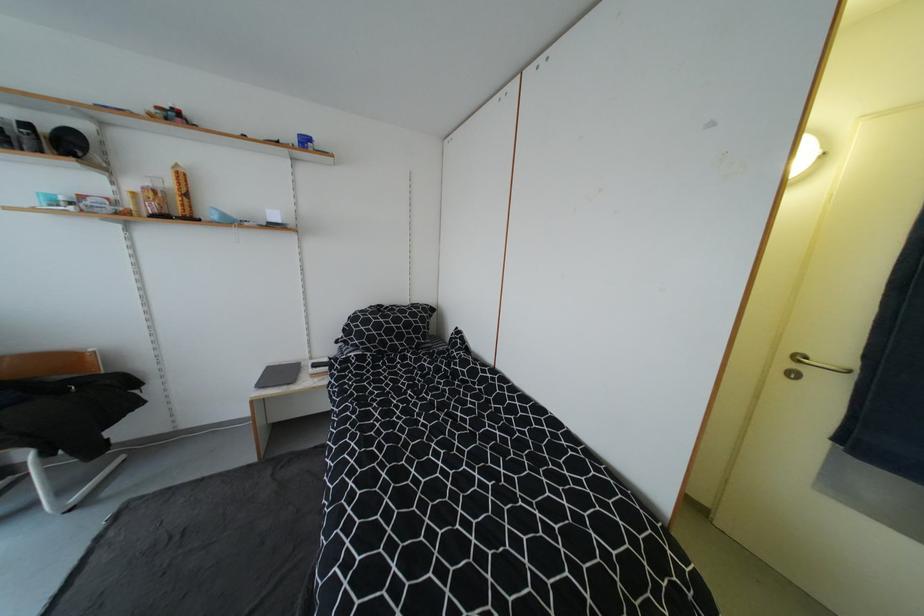
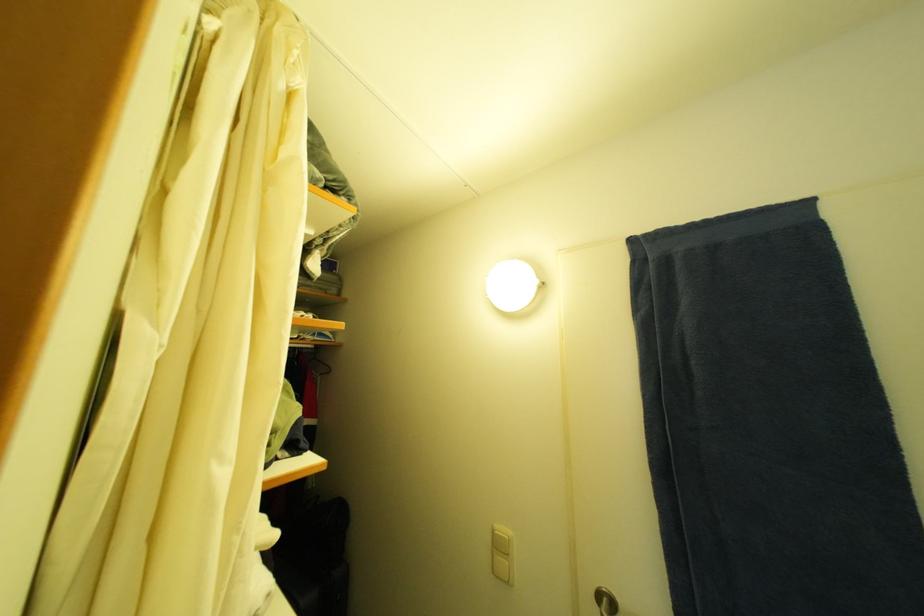
In the second image, find the point that corresponds to the point at 798,357 in the first image.

(603, 596)